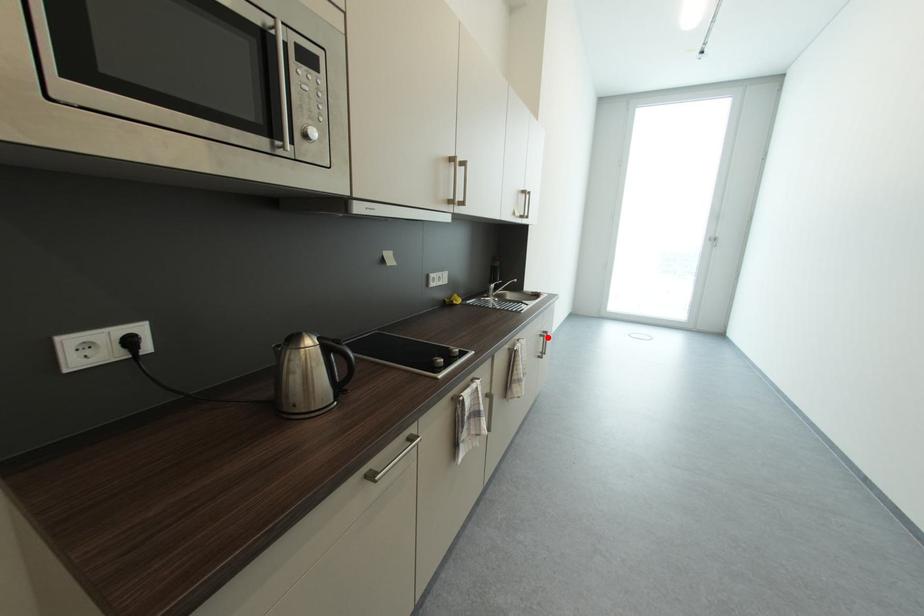
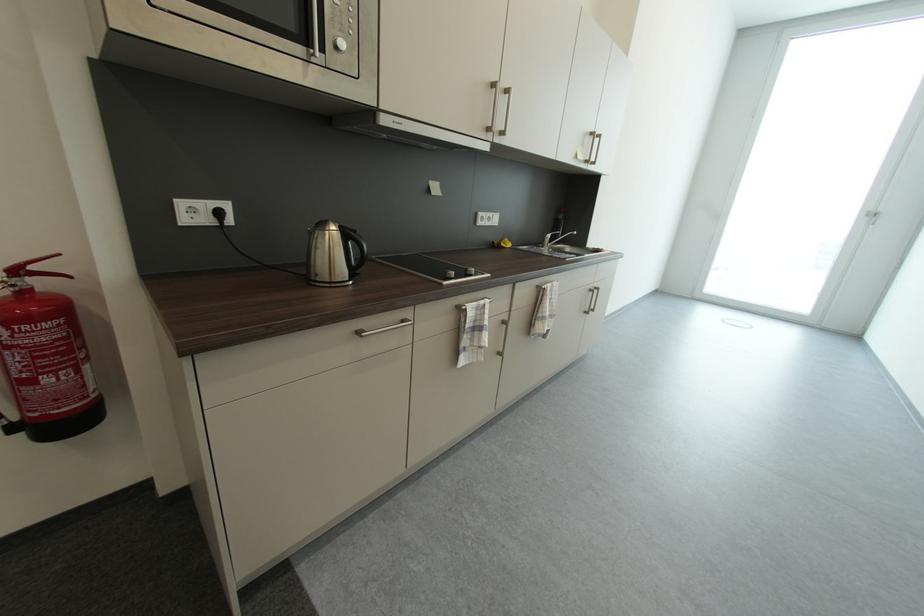
Question: I am providing you with two images of the same scene from different viewpoints. In image1, a red point is highlighted. Considering the same 3D point in image2, which of the following is correct?

Choices:
 (A) It is closer
 (B) It is farther

Answer: (B)